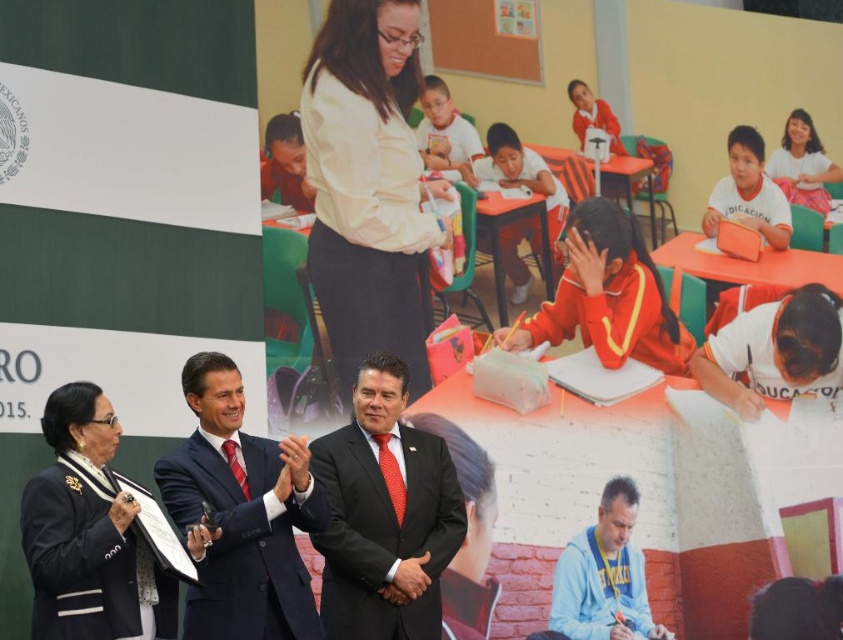
Question: Which is nearer to the matte white shirt at upper right?

Choices:
 (A) orange fabric uniform at center
 (B) black leather jacket at lower left
 (C) white matte blouse at upper center
 (D) shiny dark suit at center

Answer: (A)

Question: Among these objects, which one is farthest from the camera?

Choices:
 (A) white matte blouse at upper center
 (B) matte white shirt at upper right
 (C) light blue fleece at lower right
 (D) orange fabric uniform at center

Answer: (B)

Question: Is black leather jacket at lower left smaller than matte white shirt at upper right?

Choices:
 (A) no
 (B) yes

Answer: (B)

Question: Is shiny black suit at center thinner than shiny dark suit at center?

Choices:
 (A) no
 (B) yes

Answer: (B)

Question: Observing the image, what is the correct spatial positioning of shiny dark suit at center in reference to light blue fleece at lower right?

Choices:
 (A) below
 (B) above

Answer: (B)

Question: Estimate the real-world distances between objects in this image. Which object is farther from the black leather jacket at lower left?

Choices:
 (A) orange fabric uniform at center
 (B) matte white shirt at upper right
 (C) white matte blouse at upper center
 (D) shiny black suit at center

Answer: (B)